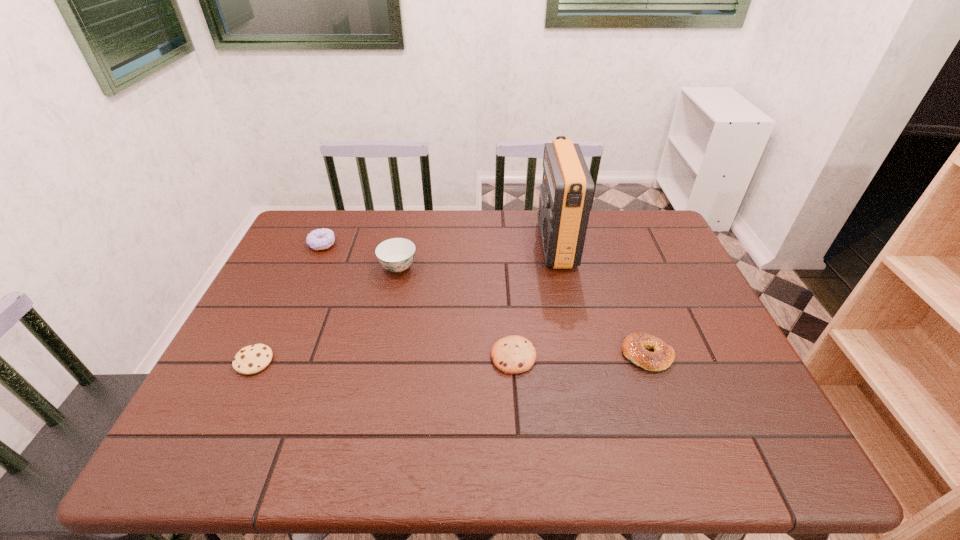
Identify the location of free space that satisfies the following two spatial constraints: 1. on the front-facing side of the bagel; 2. on the right side of the fifth object from left to right. The image size is (960, 540). (580, 355).

Find the location of a particular element. free spot that satisfies the following two spatial constraints: 1. on the front-facing side of the bagel; 2. on the left side of the fifth object from left to right is located at coordinates (580, 355).

Find the location of a particular element. The width and height of the screenshot is (960, 540). free space that satisfies the following two spatial constraints: 1. on the front-facing side of the second object from right to left; 2. on the left side of the bagel is located at coordinates (580, 355).

Where is `free point that satisfies the following two spatial constraints: 1. on the front side of the doughnut; 2. on the left side of the rightmost object`? The width and height of the screenshot is (960, 540). free point that satisfies the following two spatial constraints: 1. on the front side of the doughnut; 2. on the left side of the rightmost object is located at coordinates (273, 355).

The image size is (960, 540). I want to click on vacant space that satisfies the following two spatial constraints: 1. on the back side of the left cookie; 2. on the right side of the soup bowl, so coord(300,267).